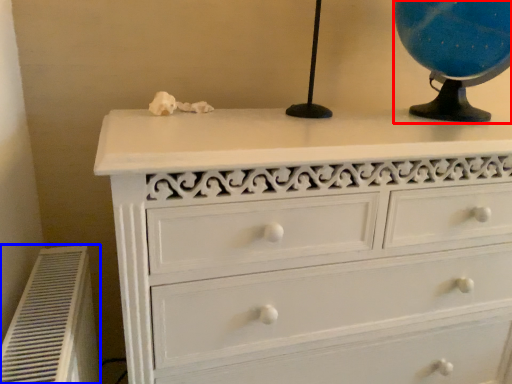
Question: Which point is further to the camera, table lamp (highlighted by a red box) or air conditioner (highlighted by a blue box)?

Choices:
 (A) table lamp
 (B) air conditioner

Answer: (A)